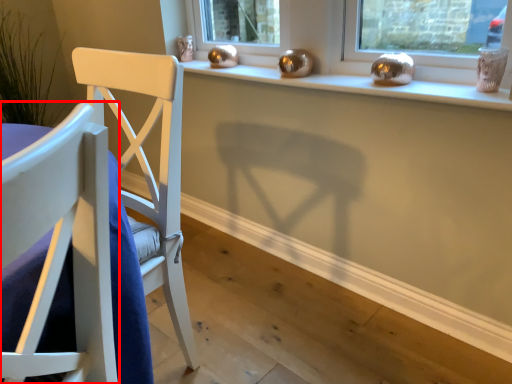
Question: Considering the relative positions of chair (annotated by the red box) and window sill in the image provided, where is chair (annotated by the red box) located with respect to the staircase?

Choices:
 (A) right
 (B) left

Answer: (B)